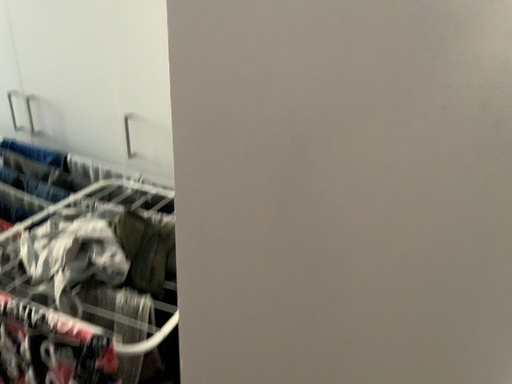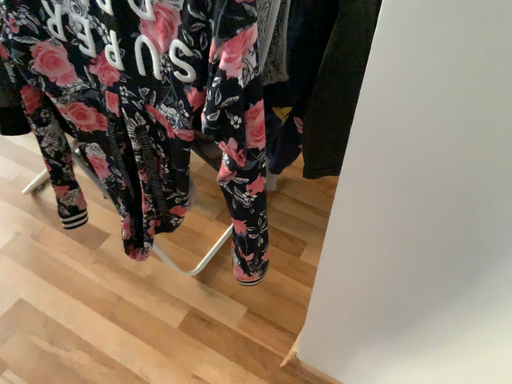
Question: How did the camera likely rotate when shooting the video?

Choices:
 (A) rotated downward
 (B) rotated upward

Answer: (A)